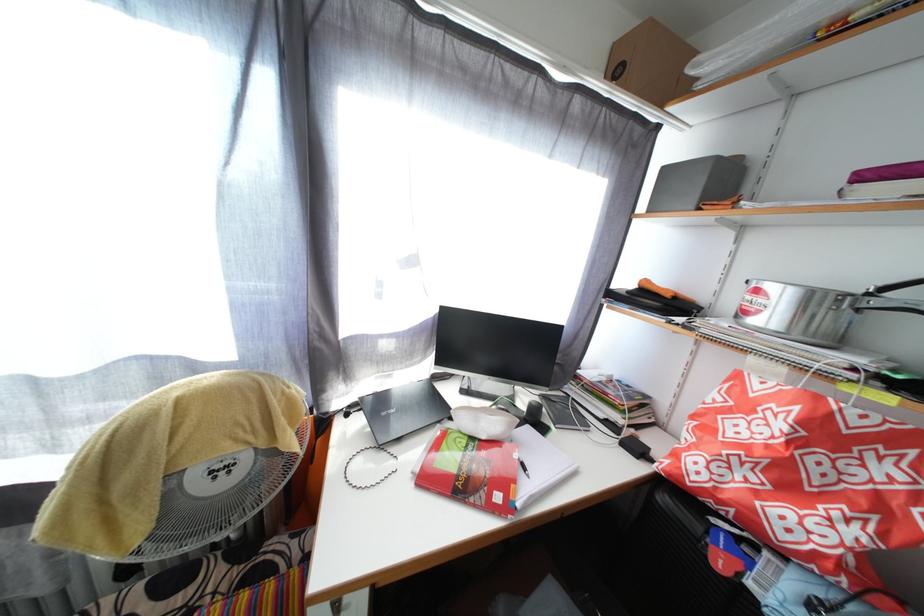
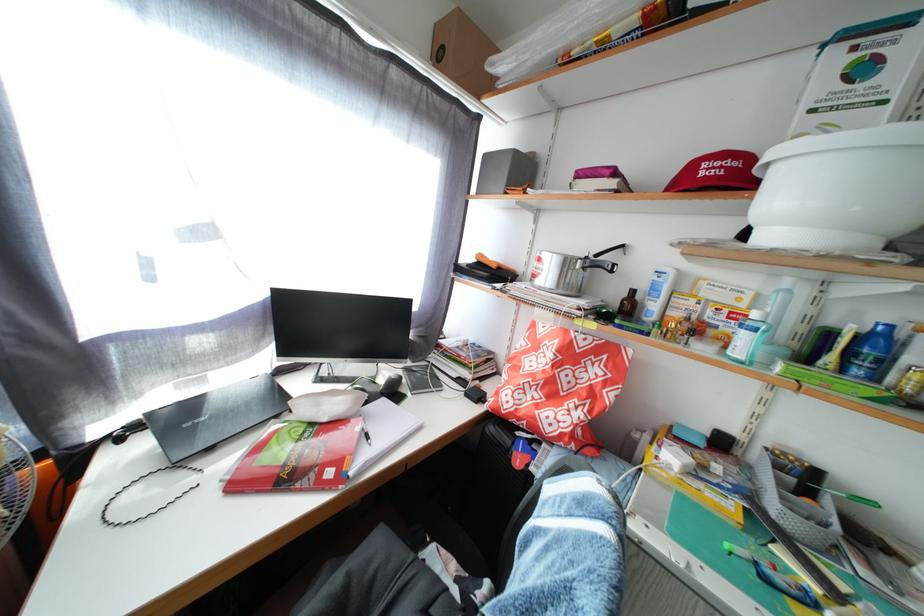
Find the pixel in the second image that matches the point at 525,462 in the first image.

(367, 435)